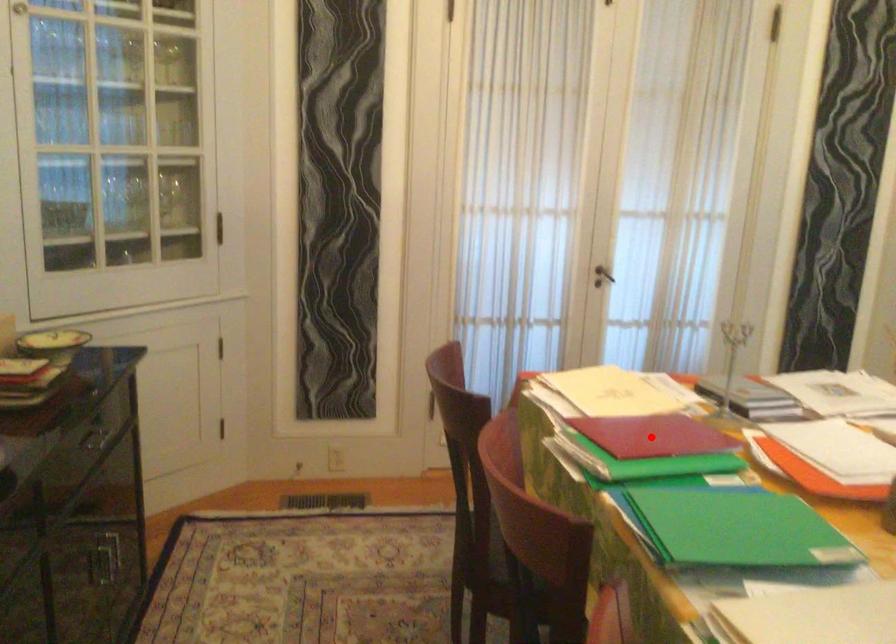
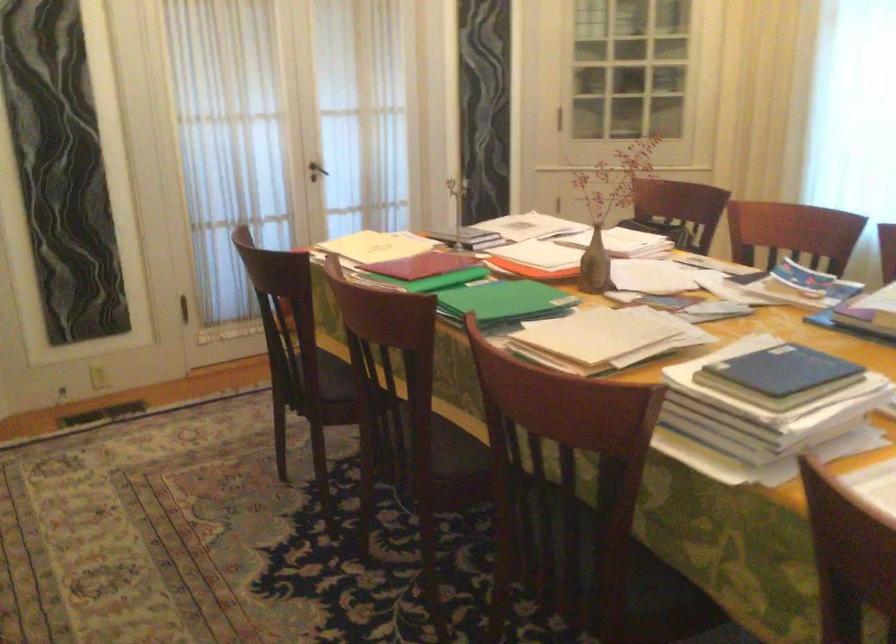
Find the pixel in the second image that matches the highlighted location in the first image.

(423, 265)